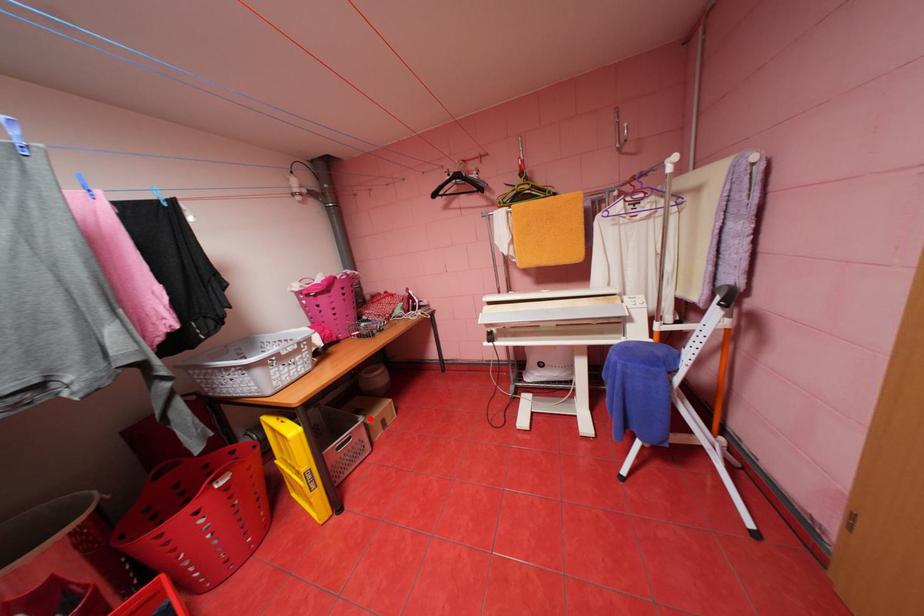
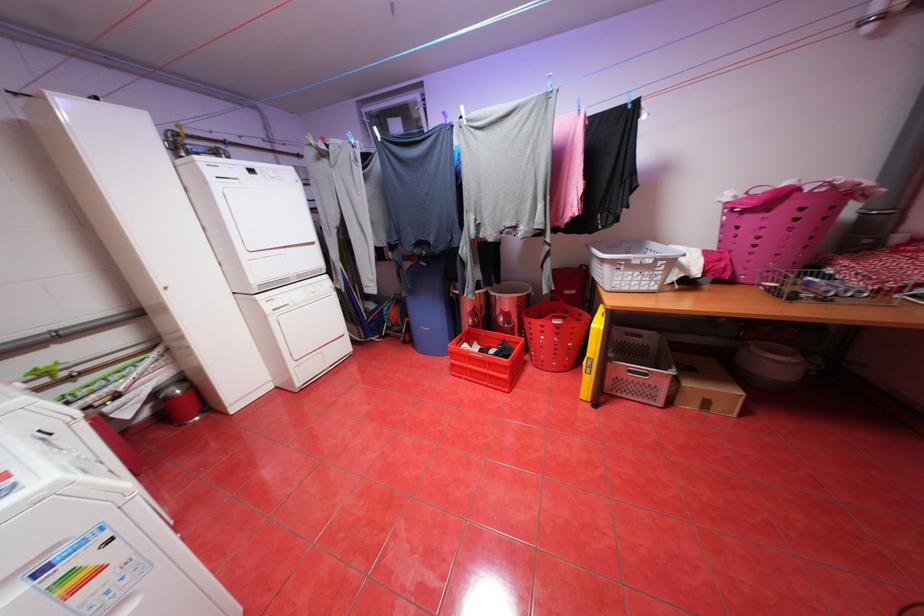
Question: I am providing you with two images of the same scene from different viewpoints. Image1 has a red point marked. In image2, the corresponding 3D location appears at what relative position? Reply with the corresponding letter.

Choices:
 (A) Closer
 (B) Farther

Answer: (B)